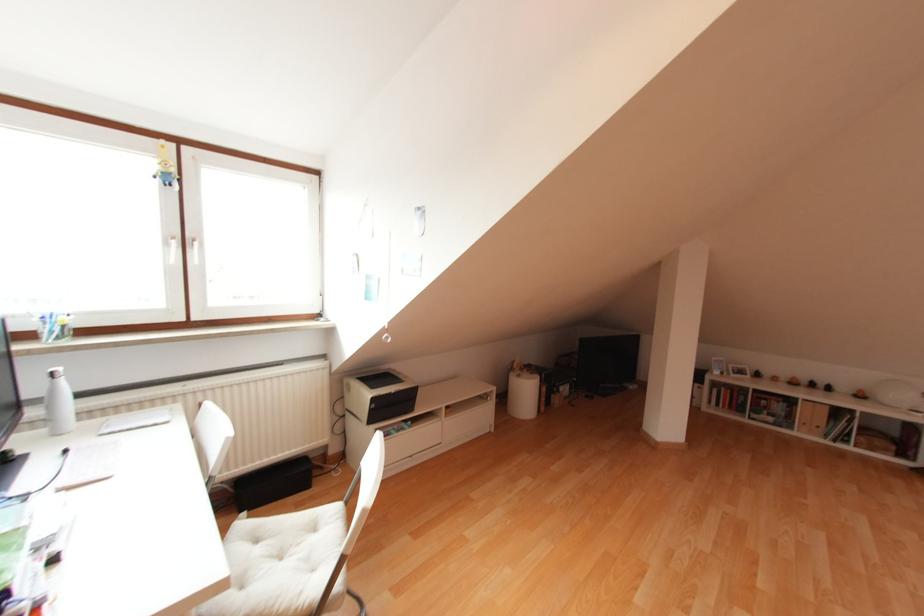
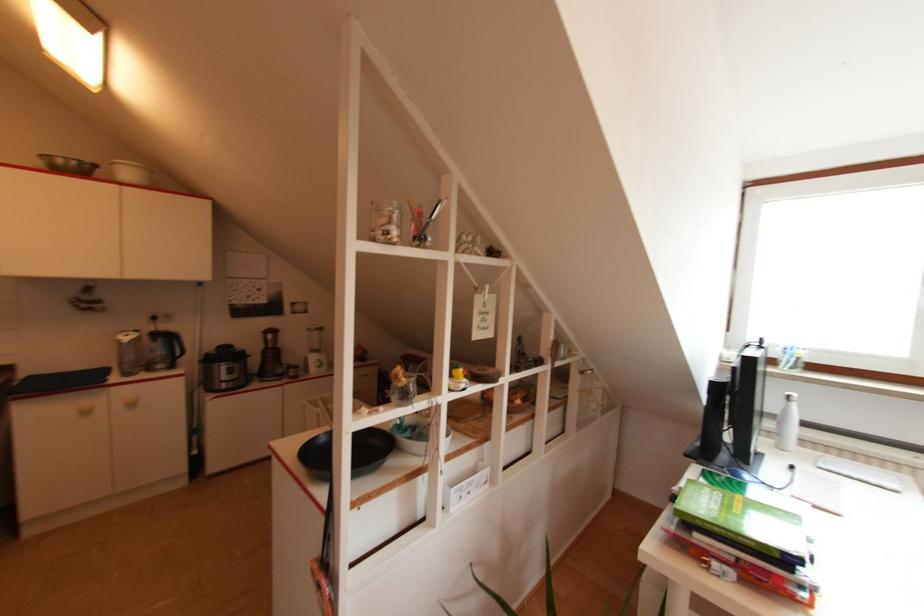
In the second image, find the point that corresponds to [54,375] in the first image.

(787, 399)